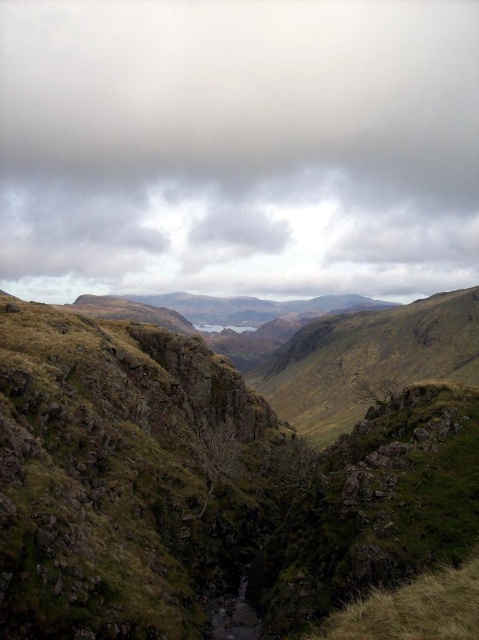
Who is positioned more to the right, gray cloudy sky at upper center or green grassy terrain at center?

green grassy terrain at center

From the picture: Measure the distance from gray cloudy sky at upper center to green grassy terrain at center.

They are 676.33 meters apart.

What do you see at coordinates (239, 147) in the screenshot? This screenshot has height=640, width=479. I see `gray cloudy sky at upper center` at bounding box center [239, 147].

This screenshot has width=479, height=640. Identify the location of gray cloudy sky at upper center. (239, 147).